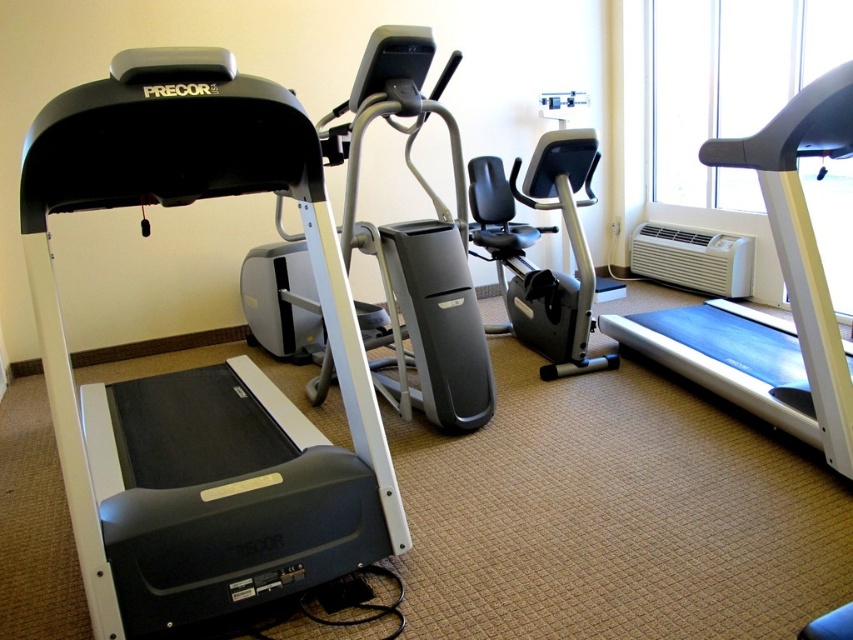
Who is lower down, matte black treadmill at left or blue rubber treadmill at right?

matte black treadmill at left is lower down.

Consider the image. Does matte black treadmill at left have a larger size compared to blue rubber treadmill at right?

Yes, matte black treadmill at left is bigger than blue rubber treadmill at right.

Between point (276, 173) and point (793, 161), which one is positioned in front?

Point (276, 173) is in front.

Locate an element on the screen. Image resolution: width=853 pixels, height=640 pixels. matte black treadmill at left is located at coordinates (200, 368).